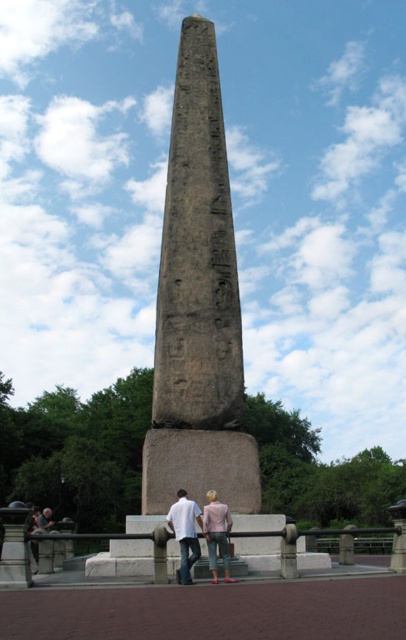
From the picture: Between granite obelisk at center and pink fabric pants at lower center, which one has more height?

granite obelisk at center

Consider the image. Does granite obelisk at center have a larger size compared to pink fabric pants at lower center?

Correct, granite obelisk at center is larger in size than pink fabric pants at lower center.

Image resolution: width=406 pixels, height=640 pixels. In order to click on granite obelisk at center in this screenshot , I will do `click(198, 305)`.

Is granite obelisk at center to the left of white cotton shirt at center from the viewer's perspective?

Yes, granite obelisk at center is to the left of white cotton shirt at center.

Can you confirm if granite obelisk at center is bigger than white cotton shirt at center?

Yes, granite obelisk at center is bigger than white cotton shirt at center.

Is point (170, 346) farther from viewer compared to point (194, 528)?

Yes, it is behind point (194, 528).

The height and width of the screenshot is (640, 406). Find the location of `granite obelisk at center`. granite obelisk at center is located at coordinates (198, 305).

Is white cotton shirt at center to the right of pink fabric pants at lower center from the viewer's perspective?

In fact, white cotton shirt at center is to the left of pink fabric pants at lower center.

Between white cotton shirt at center and pink fabric pants at lower center, which one has more height?

white cotton shirt at center

Who is more distant from viewer, (177, 529) or (211, 547)?

The point (177, 529) is more distant.

You are a GUI agent. You are given a task and a screenshot of the screen. Output one action in this format:
    pyautogui.click(x=<x>, y=<y>)
    Task: Click on the white cotton shirt at center
    The image size is (406, 640).
    Given the screenshot: What is the action you would take?
    pyautogui.click(x=185, y=532)